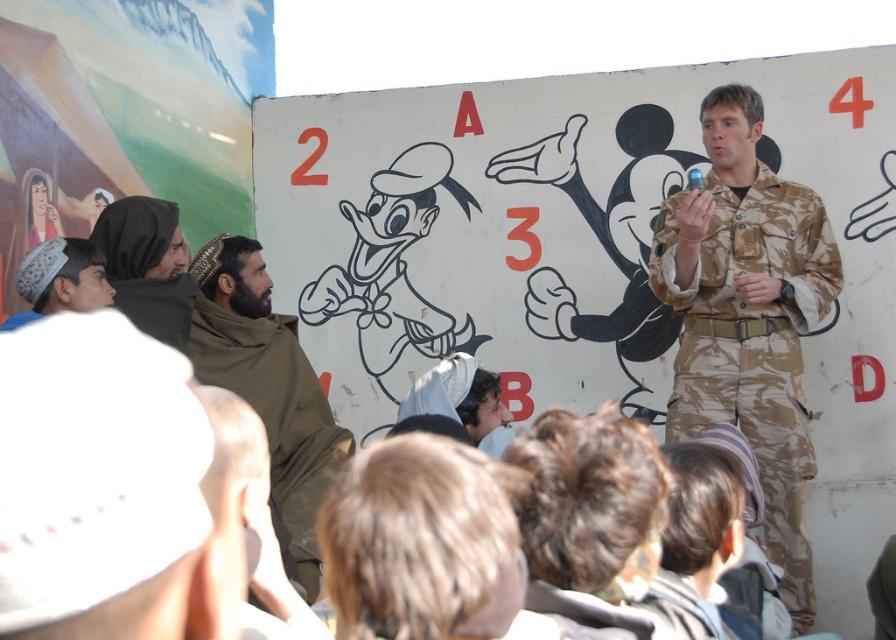
You are a photographer at the event and want to capture a photo that includes both the camouflage uniform at center and the light brown fabric cap at left. Based on their positions, which object should you focus on first to ensure both are in frame?

The camouflage uniform at center is positioned under the light brown fabric cap at left, so focusing on the light brown fabric cap at left first will ensure both are in frame.

You are part of the audience sitting on the ground and want to hand a question card to the speaker. The camouflage uniform at center is the speaker. You have to pass the card to them. The light brown fabric cap at left is an assistant. Which object is closer to you so you can pass the card more easily?

The camouflage uniform at center is closer to you than the light brown fabric cap at left, so you can pass the card more easily to the camouflage uniform at center.

You are organizing a photo shoot and need to place two props on a shelf. The camouflage uniform at center and the brown woolen scarf at left must be arranged such that the wider item is placed on the left side of the shelf. Which object should go on the left side?

The camouflage uniform at center is wider than the brown woolen scarf at left, so it should be placed on the left side of the shelf to meet the requirement.